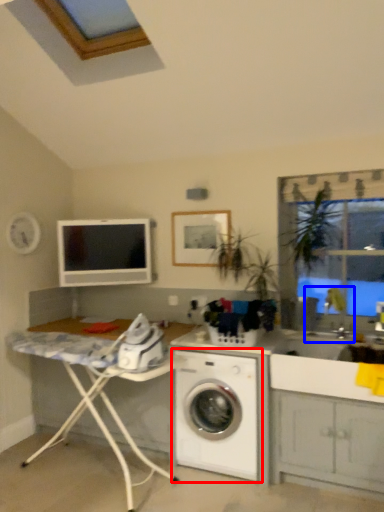
Question: Which of the following is the farthest to the observer, washing machine (highlighted by a red box) or sink (highlighted by a blue box)?

Choices:
 (A) washing machine
 (B) sink

Answer: (B)